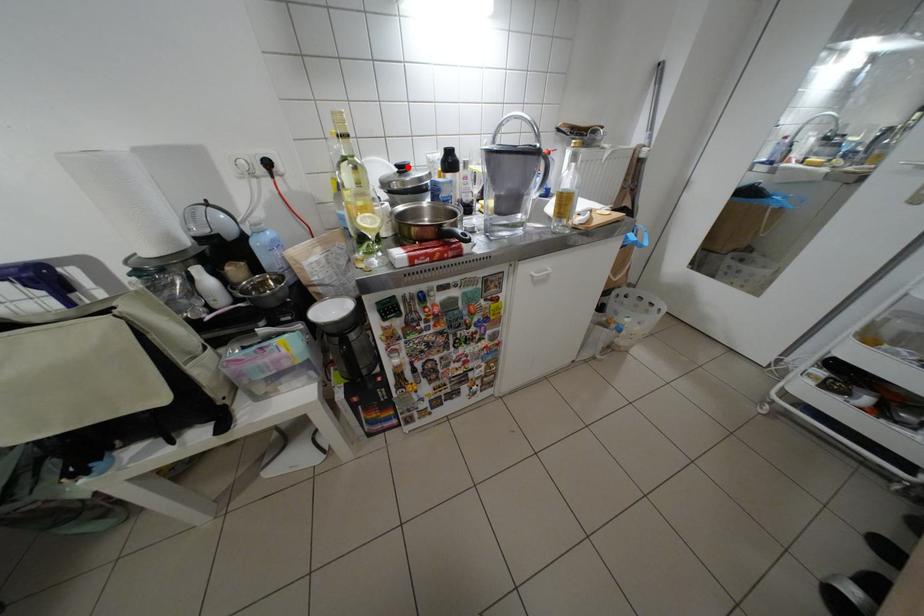
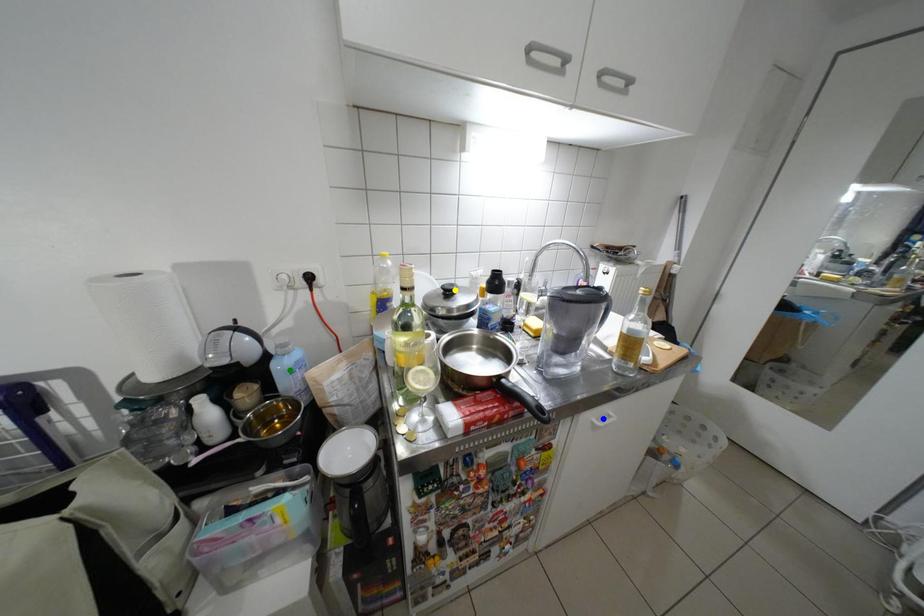
Question: I am providing you with two images of the same scene from different viewpoints. A red point is marked on the first image. You are given multiple points on the second image. Can you choose the point in image 2 that corresponds to the point in image 1?

Choices:
 (A) green point
 (B) blue point
 (C) yellow point

Answer: (C)